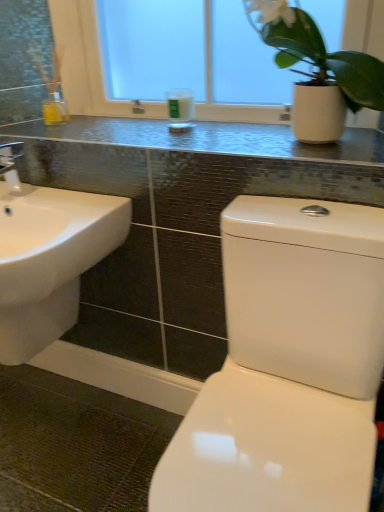
Question: Is white glossy sink at lower left facing away from metallic mosaic tile counter top at upper center?

Choices:
 (A) yes
 (B) no

Answer: (B)

Question: Does white glossy sink at lower left contain metallic mosaic tile counter top at upper center?

Choices:
 (A) yes
 (B) no

Answer: (B)

Question: Is white glossy sink at lower left positioned in front of metallic mosaic tile counter top at upper center?

Choices:
 (A) no
 (B) yes

Answer: (B)

Question: Is white glossy sink at lower left facing towards metallic mosaic tile counter top at upper center?

Choices:
 (A) no
 (B) yes

Answer: (A)

Question: Does white glossy sink at lower left appear on the left side of metallic mosaic tile counter top at upper center?

Choices:
 (A) yes
 (B) no

Answer: (A)

Question: Considering their positions, is white glossy sink at lower left located in front of or behind metallic mosaic tile counter top at upper center?

Choices:
 (A) behind
 (B) front

Answer: (B)

Question: Looking at their shapes, would you say white glossy sink at lower left is wider or thinner than metallic mosaic tile counter top at upper center?

Choices:
 (A) wide
 (B) thin

Answer: (A)

Question: Is white glossy sink at lower left inside the boundaries of metallic mosaic tile counter top at upper center, or outside?

Choices:
 (A) inside
 (B) outside

Answer: (B)

Question: In terms of size, does white glossy sink at lower left appear bigger or smaller than metallic mosaic tile counter top at upper center?

Choices:
 (A) small
 (B) big

Answer: (B)

Question: In terms of height, does white matte pot at upper right look taller or shorter compared to white frosted glass at upper center?

Choices:
 (A) short
 (B) tall

Answer: (A)

Question: Is point [379, 90] closer or farther from the camera than point [193, 24]?

Choices:
 (A) closer
 (B) farther

Answer: (A)

Question: From the image's perspective, is white matte pot at upper right above or below white frosted glass at upper center?

Choices:
 (A) above
 (B) below

Answer: (B)

Question: In the image, is white matte pot at upper right on the left side or the right side of white frosted glass at upper center?

Choices:
 (A) right
 (B) left

Answer: (A)

Question: Considering their positions, is white frosted glass at upper center located in front of or behind white glass candle at center?

Choices:
 (A) behind
 (B) front

Answer: (B)

Question: Visually, is white frosted glass at upper center positioned to the left or to the right of white glass candle at center?

Choices:
 (A) left
 (B) right

Answer: (B)